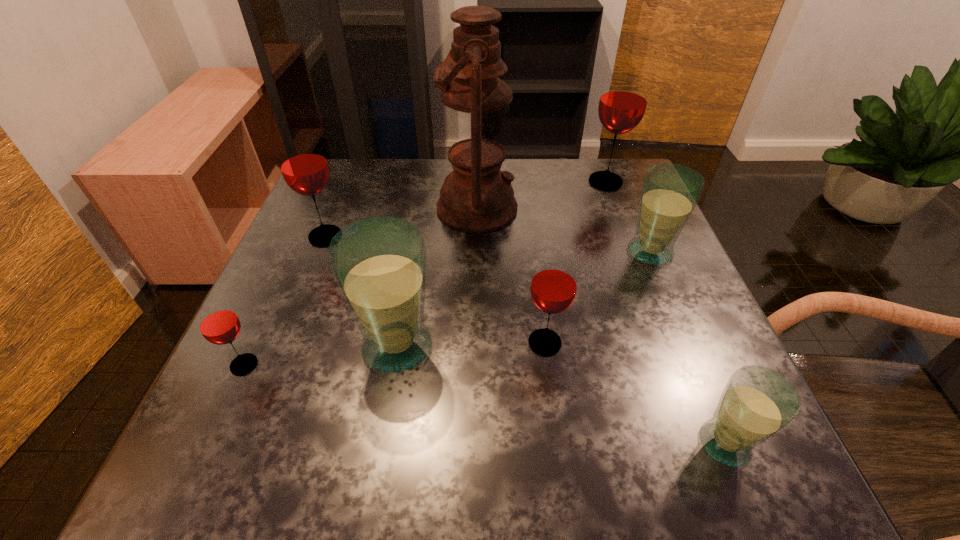
Find the location of a particular element. object that is the second nearest to the third nearest red glass is located at coordinates pyautogui.click(x=379, y=263).

This screenshot has height=540, width=960. I want to click on object that stands as the second closest to the third red glass from left to right, so click(757, 403).

Identify which glass is located as the fifth nearest to the oil lamp. Please provide its 2D coordinates. Your answer should be formatted as a tuple, i.e. [(x, y)], where the tuple contains the x and y coordinates of a point satisfying the conditions above.

[(553, 288)]

Locate an element on the screen. This screenshot has height=540, width=960. glass object that ranks as the third closest to the smallest red glass is located at coordinates (x=553, y=288).

You are a GUI agent. You are given a task and a screenshot of the screen. Output one action in this format:
    pyautogui.click(x=<x>, y=<y>)
    Task: Click on the red glass that is the fourth nearest to the farthest blue glass
    This screenshot has height=540, width=960.
    Given the screenshot: What is the action you would take?
    pyautogui.click(x=218, y=323)

You are a GUI agent. You are given a task and a screenshot of the screen. Output one action in this format:
    pyautogui.click(x=<x>, y=<y>)
    Task: Click on the red glass object that ranks as the fourth closest to the oil lamp
    The image size is (960, 540).
    Given the screenshot: What is the action you would take?
    pyautogui.click(x=218, y=323)

Identify the location of blue glass that is the third nearest to the tallest object. pos(757,403).

Point out which blue glass is positioned as the nearest to the nearest object. Please provide its 2D coordinates. Your answer should be formatted as a tuple, i.e. [(x, y)], where the tuple contains the x and y coordinates of a point satisfying the conditions above.

[(670, 192)]

In order to click on vacant area in the image that satisfies the following two spatial constraints: 1. on the front side of the nearest glass; 2. on the right side of the farthest red glass in this screenshot , I will do `click(705, 443)`.